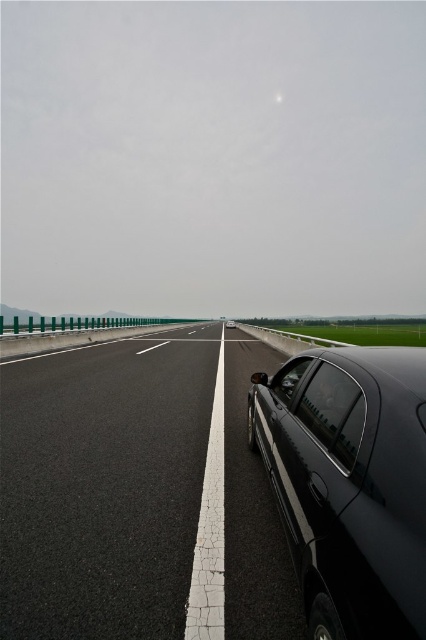
Question: Does black asphalt highway at center have a greater width compared to glossy black car at right?

Choices:
 (A) no
 (B) yes

Answer: (B)

Question: Can you confirm if glossy black car at right is positioned to the left of glossy black car at center?

Choices:
 (A) yes
 (B) no

Answer: (A)

Question: Which point is farther from the camera taking this photo?

Choices:
 (A) (34, 492)
 (B) (256, 408)
 (C) (232, 321)
 (D) (322, 368)

Answer: (C)

Question: Is glossy black car at right below transparent glass window at center?

Choices:
 (A) yes
 (B) no

Answer: (B)

Question: Among these points, which one is nearest to the camera?

Choices:
 (A) (290, 384)
 (B) (328, 577)
 (C) (330, 432)

Answer: (B)

Question: Which of the following is the farthest from the observer?

Choices:
 (A) transparent glass window at center
 (B) glossy black car at center
 (C) transparent glass window at lower right
 (D) glossy black car at right

Answer: (B)